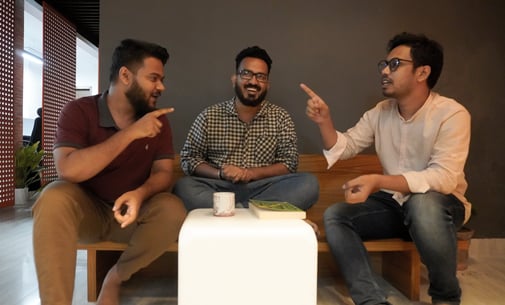
The height and width of the screenshot is (305, 505). In order to click on table in this screenshot , I will do `click(245, 270)`.